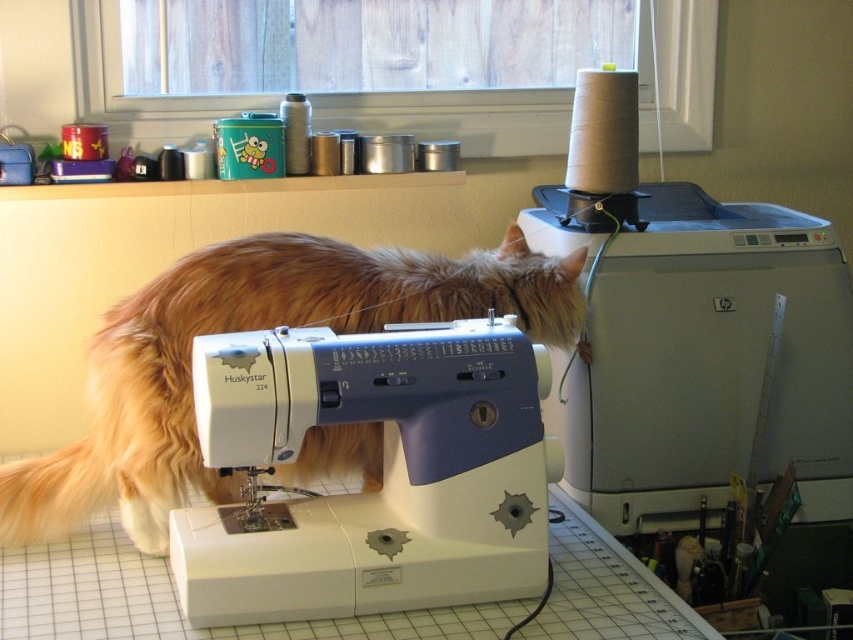
structural integrity of the white plastic sewing machine at upper right and white plastic sewing machine at center is compromised because they are stacked?

structural integrity of the white plastic sewing machine at upper right and white plastic sewing machine at center is compromised because they are stacked, which is unsafe.

You are a tailor trying to locate the HuskyStar 224 sewing machine in the scene. The machine is positioned at coordinates point (693, 333). Can you confirm if this point is in the upper right area of the image?

Yes, the point (693, 333) corresponds to the white plastic sewing machine at upper right, so it is indeed located in the upper right area of the image.

You are a delivery person who just arrived at a house and need to place a package on the floor near the white plastic sewing machine at center. The package is 2 feet wide. Can you safely place it there without moving the sewing machine?

The white plastic sewing machine at center is 3.37 feet away from the viewer. Since the package is 2 feet wide, you can safely place it near the sewing machine as there is enough space between the viewer and the machine to accommodate the package width.